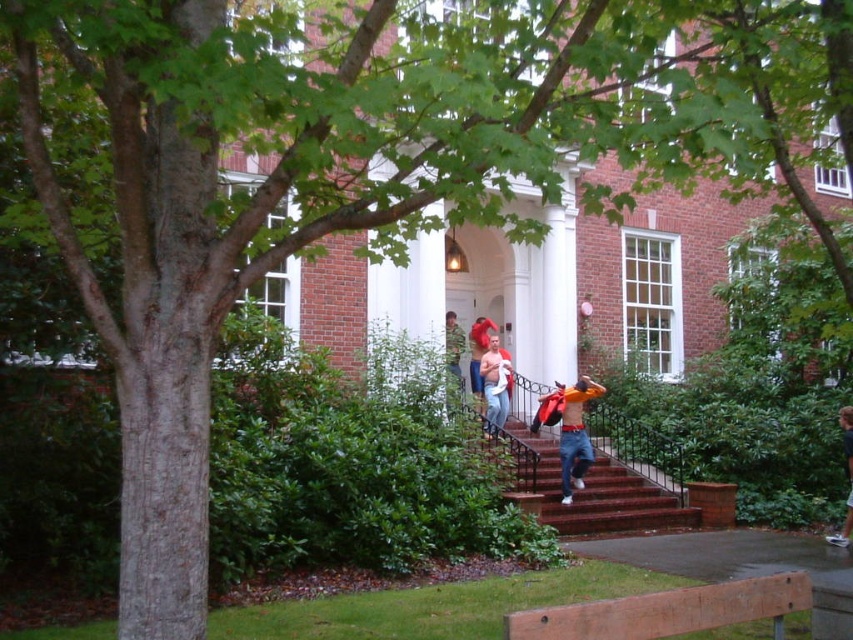
Question: Does denim jeans at center appear over light blue jeans at center?

Choices:
 (A) no
 (B) yes

Answer: (A)

Question: In this image, where is brick stairs at center located relative to matte orange shirt at center?

Choices:
 (A) below
 (B) above

Answer: (A)

Question: Which point appears farthest from the camera in this image?

Choices:
 (A) (450, 371)
 (B) (579, 515)
 (C) (577, 456)

Answer: (A)

Question: Can you confirm if light blue jeans at center is bigger than matte orange shirt at center?

Choices:
 (A) yes
 (B) no

Answer: (B)

Question: Which object is the farthest from the brick stairs at center?

Choices:
 (A) light brown leather jacket at lower right
 (B) light blue jeans at center

Answer: (A)

Question: Considering the real-world distances, which object is farthest from the light blue jeans at center?

Choices:
 (A) light brown leather jacket at lower right
 (B) brick stairs at center

Answer: (A)